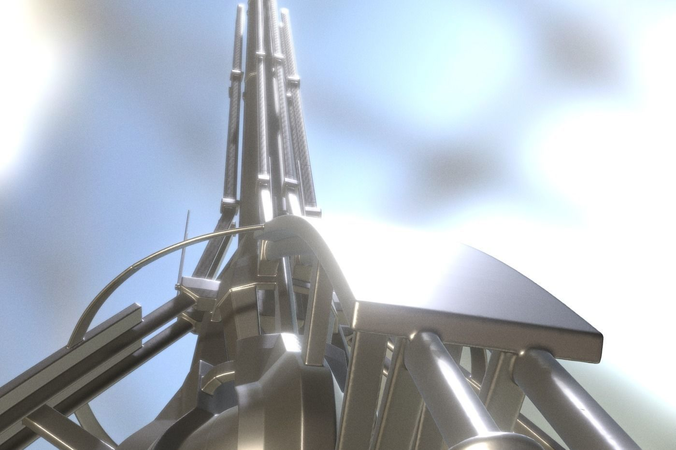
You are a GUI agent. You are given a task and a screenshot of the screen. Output one action in this format:
    pyautogui.click(x=<x>, y=<y>)
    Task: Click on the hinge
    
    Given the screenshot: What is the action you would take?
    (x=230, y=206)